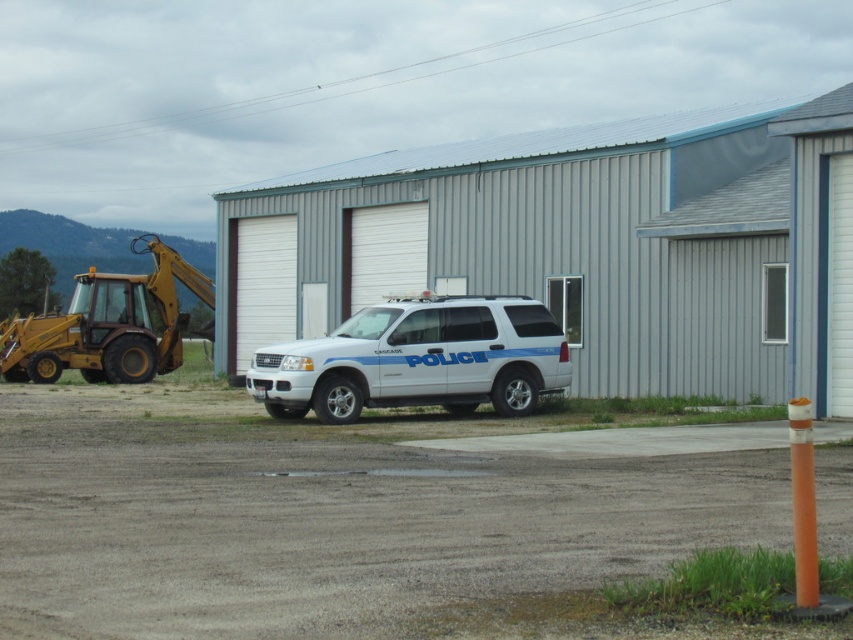
You are a delivery driver who needs to park your truck between the white matte police car at center and the yellow metallic excavator at left. Based on their current positions, which side of the excavator should you park your truck on?

The white matte police car at center is positioned on the right side of the yellow metallic excavator at left, so you should park your truck on the left side of the yellow metallic excavator at left to be between both vehicles.

You are a delivery driver who needs to park your truck in the area between the white matte police car at center and the yellow metallic excavator at left. Based on the scene, can you fit your truck there without overlapping any of the existing vehicles?

The white matte police car at center occupies less space than the yellow metallic excavator at left, so there might be enough space between them to park your truck. However, since the exact dimensions of the truck aren